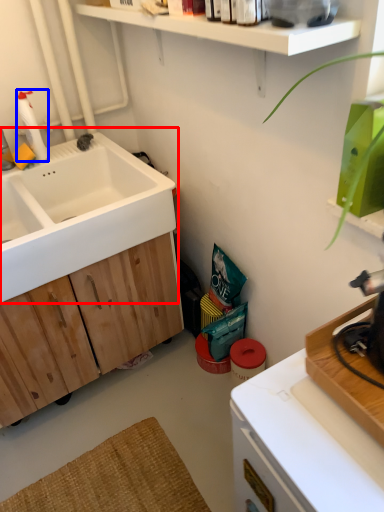
Question: Which point is further to the camera, sink (highlighted by a red box) or cleaning product (highlighted by a blue box)?

Choices:
 (A) sink
 (B) cleaning product

Answer: (B)